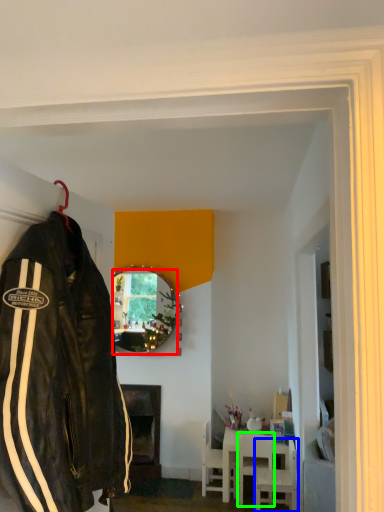
Question: Estimate the real-world distances between objects in this image. Which object is farther from mirror (highlighted by a red box), chair (highlighted by a blue box) or chair (highlighted by a green box)?

Choices:
 (A) chair
 (B) chair

Answer: (A)